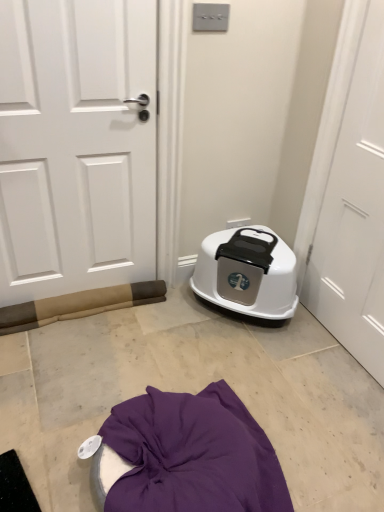
Identify the location of free space in front of white plastic litter box at center. (264, 359).